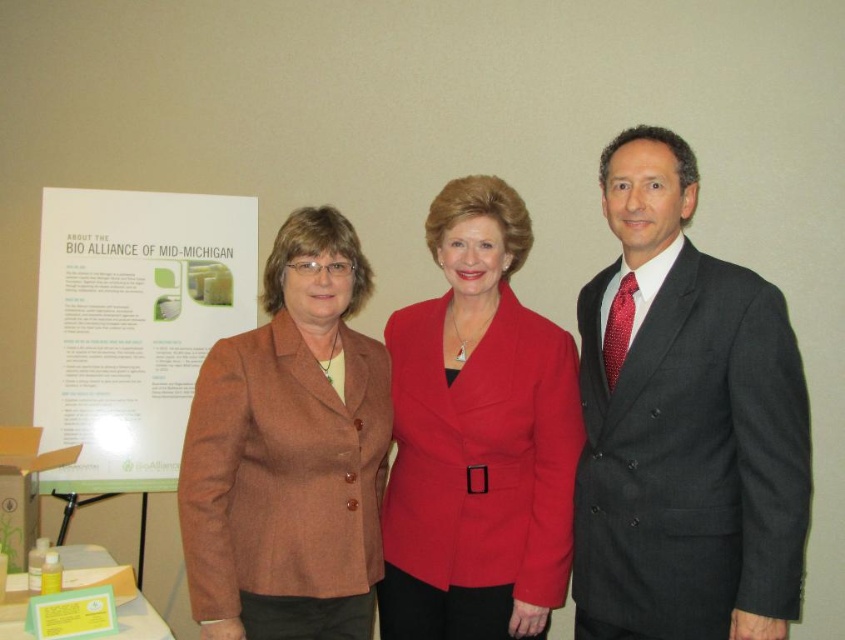
Between point (651, 131) and point (102, 477), which one is positioned in front?

Point (651, 131)

Can you confirm if dark gray suit at center is positioned above white paper at left?

Incorrect, dark gray suit at center is not positioned above white paper at left.

Who is more forward, (x=666, y=352) or (x=108, y=490)?

Point (x=666, y=352)

The image size is (845, 640). Find the location of `dark gray suit at center`. dark gray suit at center is located at coordinates (684, 424).

Is brown woolen blazer at center positioned behind white paper at left?

No, it is not.

Is point (263, 552) positioned in front of point (169, 388)?

Yes, it is.

In order to click on brown woolen blazer at center in this screenshot , I will do `click(290, 451)`.

How distant is matte red blazer at center from white paper at left?

The distance of matte red blazer at center from white paper at left is 1.03 meters.

Does matte red blazer at center appear on the left side of white paper at left?

In fact, matte red blazer at center is to the right of white paper at left.

Is point (489, 428) closer to camera compared to point (202, 225)?

Yes.

Where is `matte red blazer at center`? This screenshot has height=640, width=845. matte red blazer at center is located at coordinates click(478, 436).